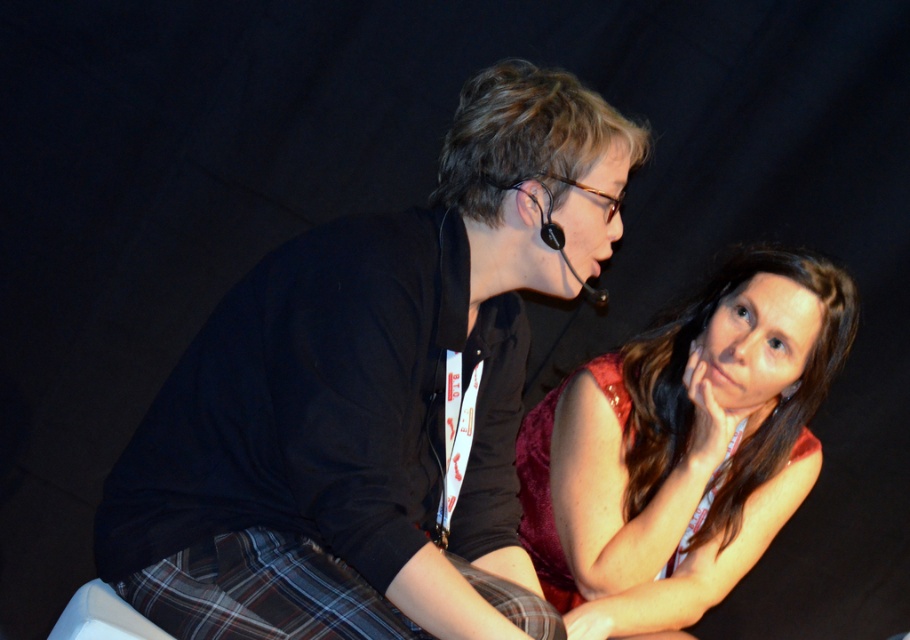
Can you confirm if black matte shirt at center is shorter than plaid fabric kilt at lower left?

No.

Is black matte shirt at center above plaid fabric kilt at lower left?

Yes.

Image resolution: width=910 pixels, height=640 pixels. What do you see at coordinates (372, 397) in the screenshot?
I see `black matte shirt at center` at bounding box center [372, 397].

At what (x,y) coordinates should I click in order to perform the action: click on black matte shirt at center. Please return your answer as a coordinate pair (x, y). The height and width of the screenshot is (640, 910). Looking at the image, I should click on (372, 397).

Which is below, matte red dress at center or plaid fabric kilt at lower left?

plaid fabric kilt at lower left

Is matte red dress at center to the left of plaid fabric kilt at lower left from the viewer's perspective?

No, matte red dress at center is not to the left of plaid fabric kilt at lower left.

I want to click on matte red dress at center, so click(x=683, y=448).

Can you confirm if black matte shirt at center is positioned to the left of matte red dress at center?

Yes, black matte shirt at center is to the left of matte red dress at center.

Between black matte shirt at center and matte red dress at center, which one is positioned lower?

matte red dress at center is lower down.

Who is more forward, (298, 545) or (762, 292)?

Positioned in front is point (298, 545).

Where is `black matte shirt at center`? The width and height of the screenshot is (910, 640). black matte shirt at center is located at coordinates pos(372,397).